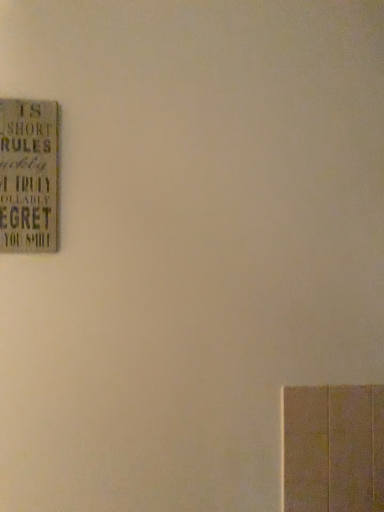
What are the coordinates of `wooden signboard at upper left` in the screenshot? It's located at [x=29, y=176].

Image resolution: width=384 pixels, height=512 pixels. What do you see at coordinates (29, 176) in the screenshot? I see `wooden signboard at upper left` at bounding box center [29, 176].

Locate an element on the screen. Image resolution: width=384 pixels, height=512 pixels. wooden signboard at upper left is located at coordinates (29, 176).